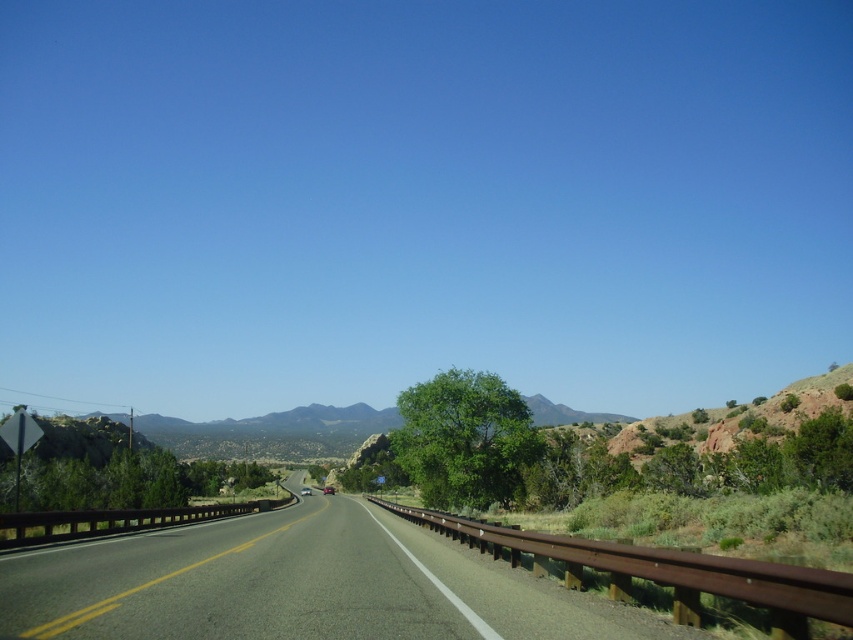
Can you confirm if asphalt road at center is wider than metallic silver motorcycle at center?

Indeed, asphalt road at center has a greater width compared to metallic silver motorcycle at center.

Between asphalt road at center and metallic silver motorcycle at center, which one appears on the left side from the viewer's perspective?

metallic silver motorcycle at center

Where is `asphalt road at center`? asphalt road at center is located at coordinates (299, 586).